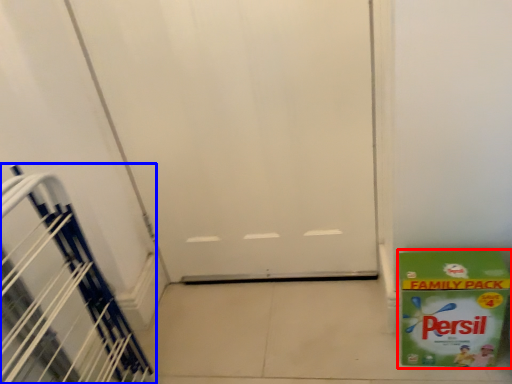
Question: Among these objects, which one is farthest to the camera, box (highlighted by a red box) or stairwell (highlighted by a blue box)?

Choices:
 (A) box
 (B) stairwell

Answer: (A)